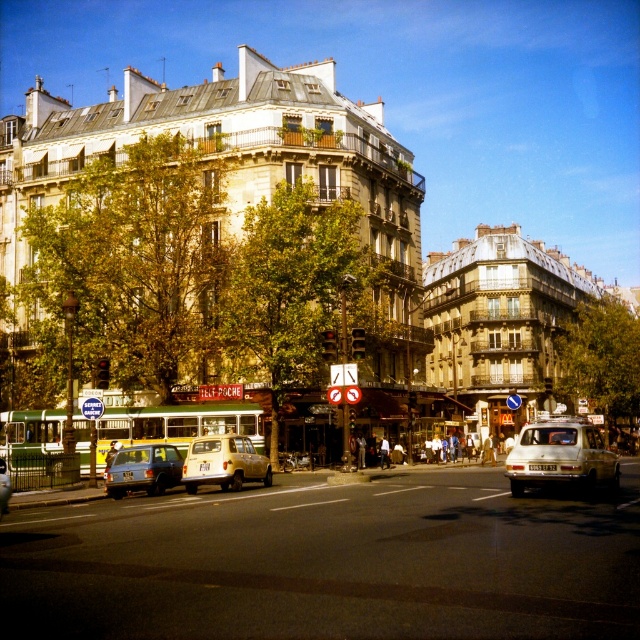
Is green matte bus at center behind metallic silver car at lower left?

Yes, green matte bus at center is behind metallic silver car at lower left.

The height and width of the screenshot is (640, 640). Identify the location of green matte bus at center. (177, 424).

Does white matte van at lower right have a lesser height compared to metallic silver car at lower left?

Incorrect, white matte van at lower right's height does not fall short of metallic silver car at lower left's.

This screenshot has width=640, height=640. Find the location of `white matte van at lower right`. white matte van at lower right is located at coordinates (561, 456).

Does point (538, 467) lie in front of point (109, 465)?

That is True.

You are a GUI agent. You are given a task and a screenshot of the screen. Output one action in this format:
    pyautogui.click(x=<x>, y=<y>)
    Task: Click on the white matte van at lower right
    The image size is (640, 640).
    Given the screenshot: What is the action you would take?
    pyautogui.click(x=561, y=456)

Is green matte bus at center further to the viewer compared to light beige matte suv at center?

Yes, green matte bus at center is behind light beige matte suv at center.

Is point (186, 419) in front of point (241, 444)?

No, (186, 419) is behind (241, 444).

The width and height of the screenshot is (640, 640). What are the coordinates of `green matte bus at center` in the screenshot? It's located at (177, 424).

In order to click on green matte bus at center in this screenshot , I will do `click(177, 424)`.